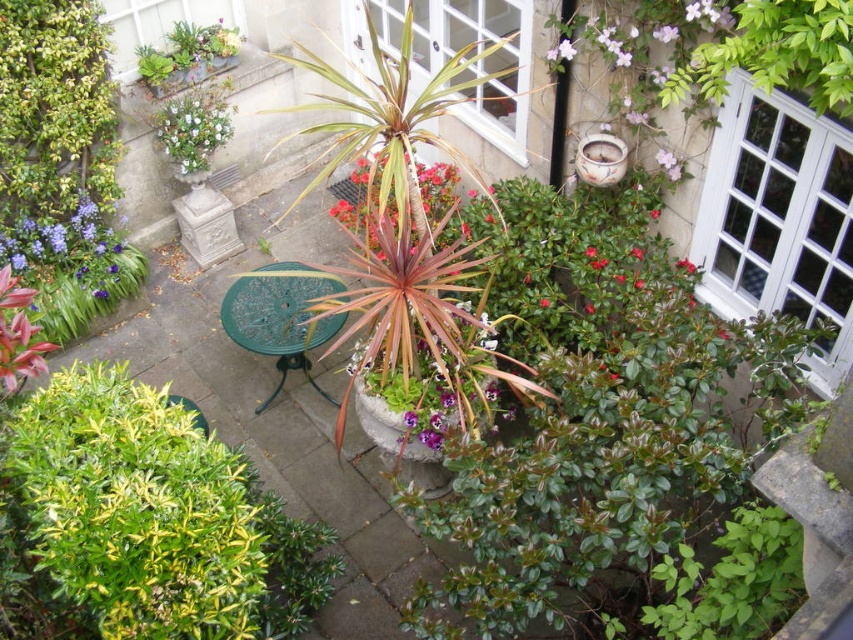
Question: Is white glossy vase at upper left positioned in front of purple glossy flower at upper center?

Choices:
 (A) no
 (B) yes

Answer: (A)

Question: Is green leafy bush at lower left bigger than white glossy vase at upper left?

Choices:
 (A) yes
 (B) no

Answer: (A)

Question: Considering the real-world distances, which object is closest to the purple glossy flower at upper center?

Choices:
 (A) purple matte flower at lower left
 (B) white glossy vase at upper left
 (C) brown textured plant at center
 (D) green leafy bush at lower left

Answer: (C)

Question: Which object appears farthest from the camera in this image?

Choices:
 (A) white glossy vase at upper left
 (B) brown textured plant at center
 (C) green leafy bush at lower left

Answer: (A)

Question: Observing the image, what is the correct spatial positioning of green leafy bush at lower left in reference to purple glossy flower at upper center?

Choices:
 (A) above
 (B) below

Answer: (B)

Question: Which object appears closest to the camera in this image?

Choices:
 (A) purple matte flower at lower left
 (B) purple glossy flower at upper center
 (C) green leafy bush at lower left

Answer: (B)